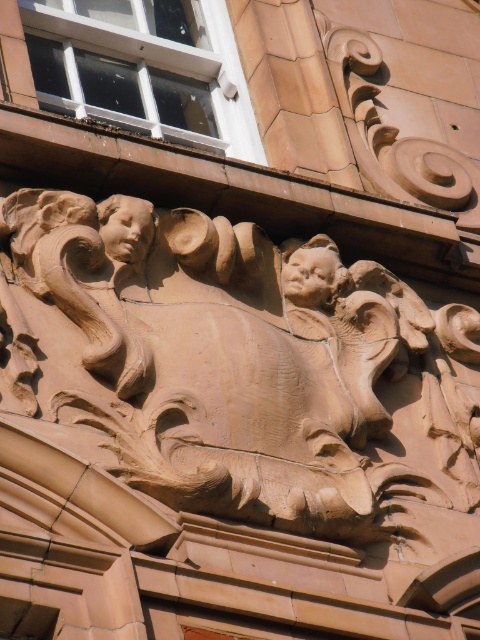
You are an art restorer examining the architectural detail. You notice two matte brown heads in the relief. Which one is closer to you, the matte brown head at upper left or the matte brown head at center?

The matte brown head at upper left is closer to you because it is positioned in front of the matte brown head at center.